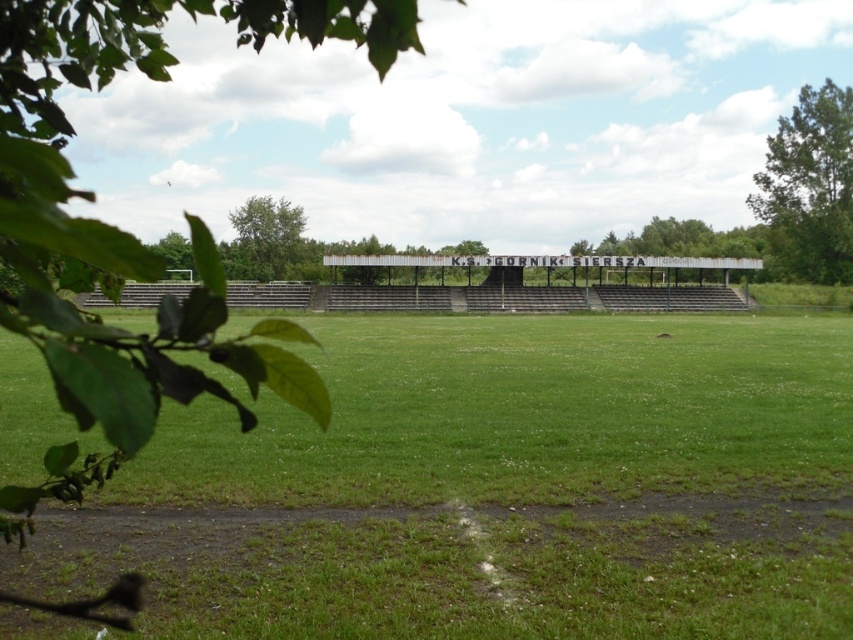
Is rusty metal sign at center closer to the viewer compared to green leafy tree at upper left?

No.

Who is more distant from viewer, (x=733, y=234) or (x=267, y=241)?

Positioned behind is point (x=733, y=234).

This screenshot has height=640, width=853. I want to click on rusty metal sign at center, so click(x=679, y=241).

Which of these two, green leafy tree at upper right or green leafy tree at upper left, stands shorter?

With less height is green leafy tree at upper left.

Is green leafy tree at upper right further to camera compared to green leafy tree at upper left?

No, it is not.

Where is `green leafy tree at upper right`? green leafy tree at upper right is located at coordinates (809, 188).

Can you confirm if green grass field at center is taller than green leafy tree at upper left?

In fact, green grass field at center may be shorter than green leafy tree at upper left.

Can you confirm if green grass field at center is positioned above green leafy tree at upper left?

Actually, green grass field at center is below green leafy tree at upper left.

Is point (335, 392) positioned behind point (235, 257)?

No, it is not.

Locate an element on the screen. The width and height of the screenshot is (853, 640). green grass field at center is located at coordinates (497, 486).